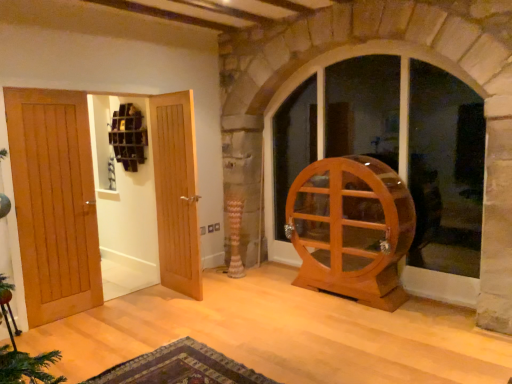
The width and height of the screenshot is (512, 384). I want to click on vacant area in front of light brown wood door at left, the 3th door in the right-to-left sequence, so click(x=58, y=331).